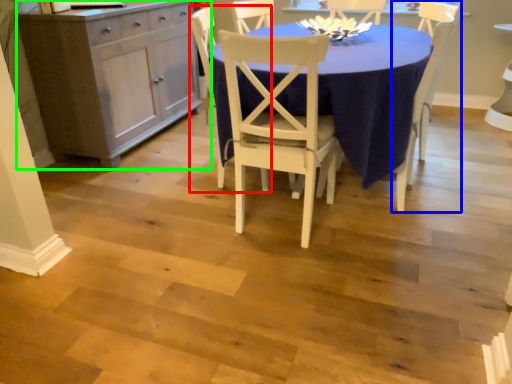
Question: Considering the real-world distances, which object is farthest from chair (highlighted by a red box)? chair (highlighted by a blue box) or cabinetry (highlighted by a green box)?

Choices:
 (A) chair
 (B) cabinetry

Answer: (A)